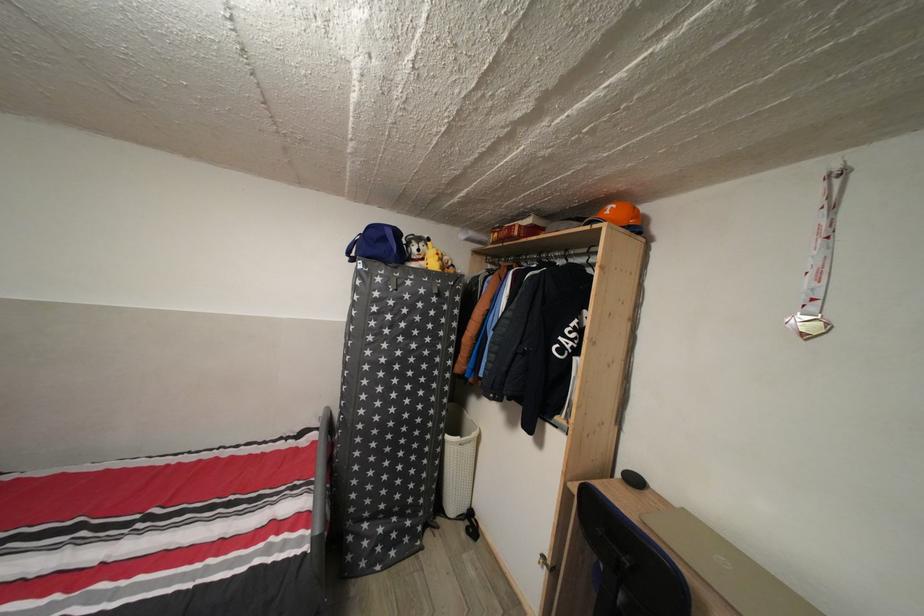
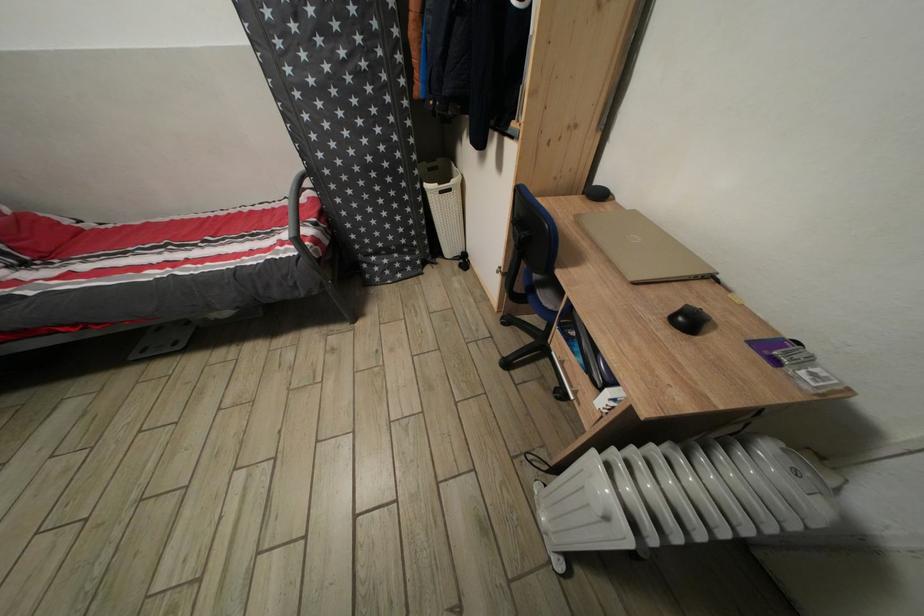
Locate, in the second image, the point that corresponds to (x=287, y=452) in the first image.

(294, 209)